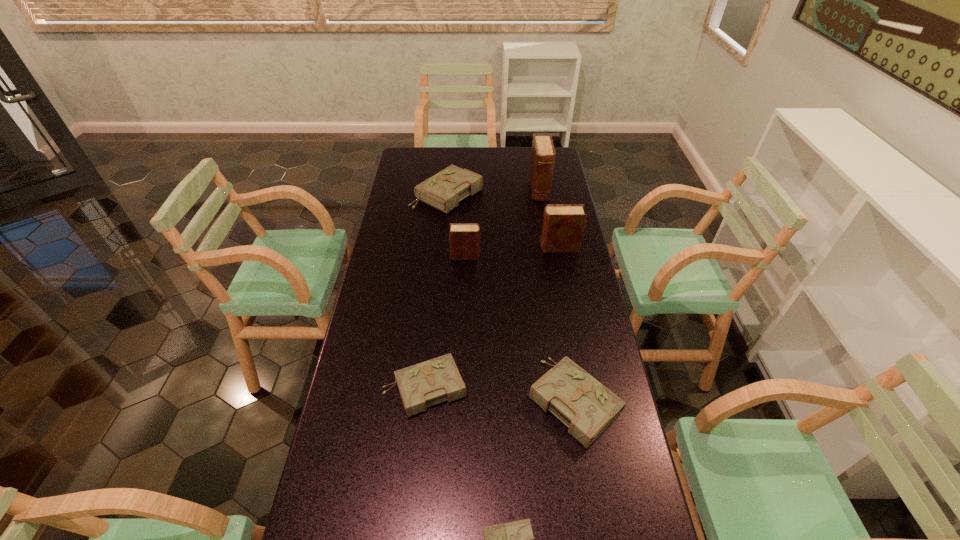
In order to click on diary that is the fifth closest to the fifth shortest diary in this screenshot , I will do `click(587, 407)`.

Where is `diary identified as the fifth closest to the second shortest object`? diary identified as the fifth closest to the second shortest object is located at coordinates (443, 191).

Locate an element on the screen. the closest brown diary to the second biggest green diary is located at coordinates (464, 239).

Identify which brown diary is located as the nearest to the fifth tallest diary. Please provide its 2D coordinates. Your answer should be formatted as a tuple, i.e. [(x, y)], where the tuple contains the x and y coordinates of a point satisfying the conditions above.

[(464, 239)]

Point out which green diary is positioned as the third nearest to the farthest green diary. Please provide its 2D coordinates. Your answer should be formatted as a tuple, i.e. [(x, y)], where the tuple contains the x and y coordinates of a point satisfying the conditions above.

[(515, 539)]

Choose which green diary is the third nearest neighbor to the fifth shortest object. Please provide its 2D coordinates. Your answer should be formatted as a tuple, i.e. [(x, y)], where the tuple contains the x and y coordinates of a point satisfying the conditions above.

[(587, 407)]

Identify the location of free space that satisfies the following two spatial constraints: 1. on the front side of the fifth tallest object; 2. on the left side of the farthest green diary. The image size is (960, 540). (428, 400).

Image resolution: width=960 pixels, height=540 pixels. I want to click on free space that satisfies the following two spatial constraints: 1. on the spine side of the second biggest green diary; 2. on the right side of the third tallest diary, so click(461, 400).

You are a GUI agent. You are given a task and a screenshot of the screen. Output one action in this format:
    pyautogui.click(x=<x>, y=<y>)
    Task: Click on the vacant space that satisfies the following two spatial constraints: 1. on the spine side of the leftmost brown diary; 2. on the left side of the third smallest green diary
    The height and width of the screenshot is (540, 960).
    Given the screenshot: What is the action you would take?
    pyautogui.click(x=461, y=400)